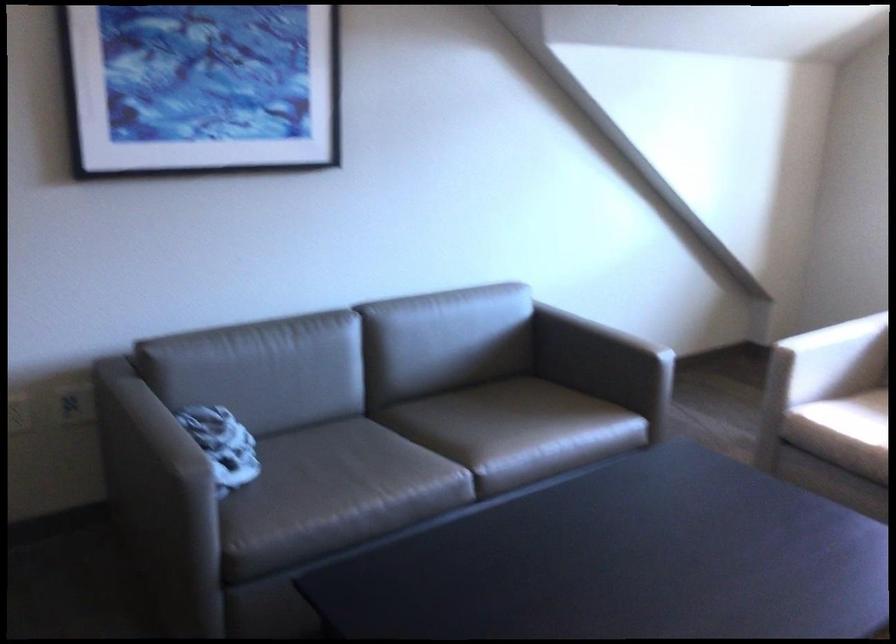
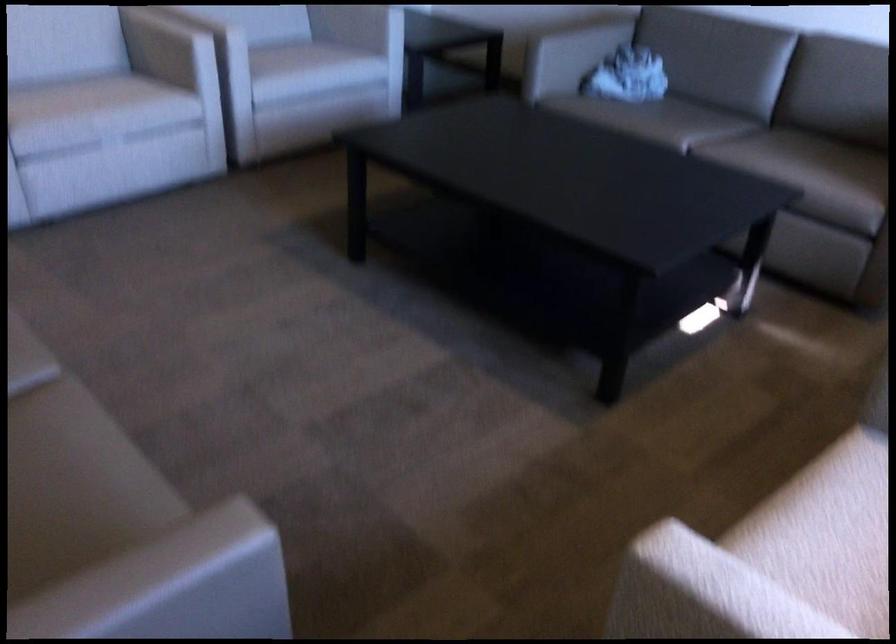
Find the pixel in the second image that matches the point at 401,438 in the first image.

(714, 127)